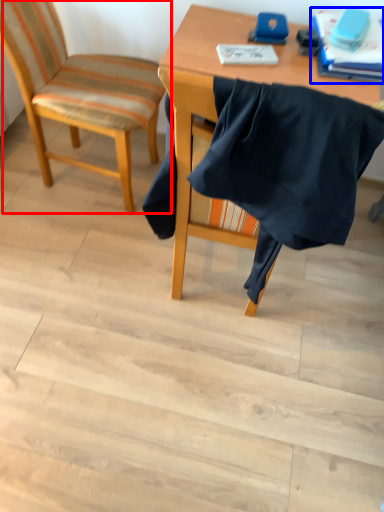
Question: Which of the following is the farthest to the observer, chair (highlighted by a red box) or book (highlighted by a blue box)?

Choices:
 (A) chair
 (B) book

Answer: (B)